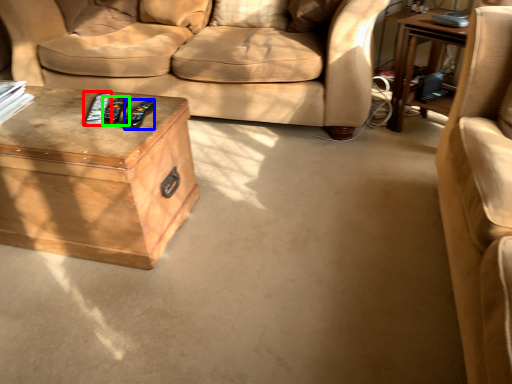
Question: Considering the real-world distances, which object is closest to remote (highlighted by a red box)? remote (highlighted by a blue box) or remote (highlighted by a green box).

Choices:
 (A) remote
 (B) remote

Answer: (B)